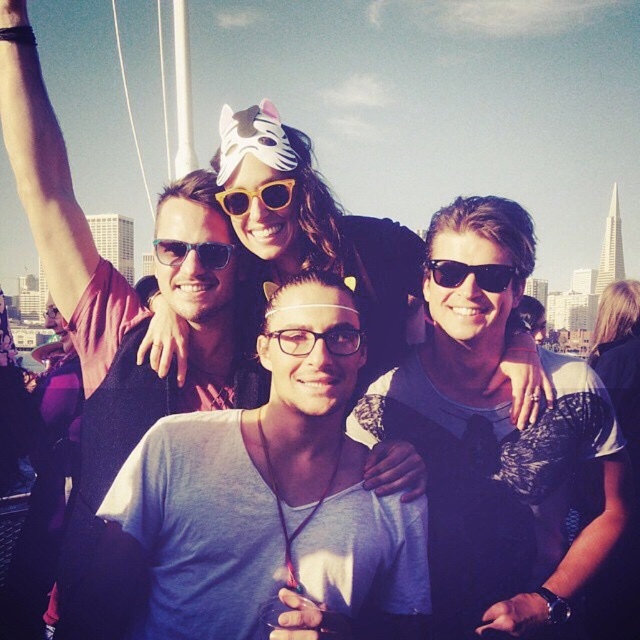
From the picture: Based on the scene description, where would you place the transparent plastic glasses at center if you were to draw them on a coordinate grid from 0 to 1 in both x and y axes?

The transparent plastic glasses at center should be placed at the coordinate point of (317, 339) on the grid.

You are a photographer trying to capture a clear shot of the white paper mask at center and the transparent plastic glasses at center. Which object should you zoom in on to ensure both are in focus, considering their sizes?

The white paper mask at center is larger than the transparent plastic glasses at center, so you should zoom in on the white paper mask at center to ensure both are in focus.

You are standing at a distance and want to take a photo of the group of five people in the center. The camera you are using has a maximum focus range of 1500 feet. Will the point at point (346, 340) be within the camera focus range?

The distance of point (346, 340) from viewer is 1483.50 feet, which is within the camera focus range of 1500 feet. Therefore, the point at point (346, 340) will be within the camera focus range.